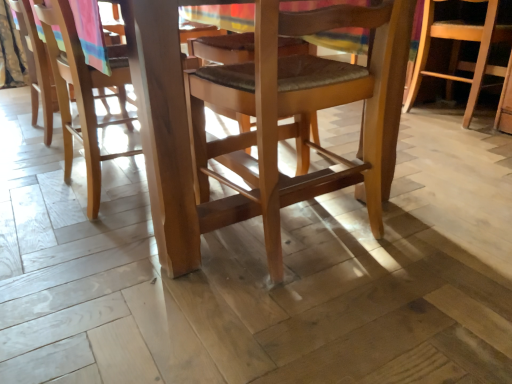
Question: Is light brown wood chair at left, placed as the 1th chair when sorted from left to right, wider than wooden chair at center, which appears as the first chair when viewed from the front?

Choices:
 (A) no
 (B) yes

Answer: (A)

Question: Does light brown wood chair at left, placed as the 1th chair when sorted from left to right, have a smaller size compared to wooden chair at center, the second chair from the right?

Choices:
 (A) yes
 (B) no

Answer: (A)

Question: From a real-world perspective, does light brown wood chair at left, the 2th chair when ordered from front to back, stand above wooden chair at center, the second chair from the right?

Choices:
 (A) no
 (B) yes

Answer: (B)

Question: Can you see light brown wood chair at left, placed as the 1th chair when sorted from left to right, touching wooden chair at center, the second chair from the right?

Choices:
 (A) yes
 (B) no

Answer: (B)

Question: Is light brown wood chair at left, placed as the 1th chair when sorted from left to right, positioned far away from wooden chair at center, the second chair from the right?

Choices:
 (A) yes
 (B) no

Answer: (A)

Question: Is wooden chair at center, positioned as the 3th chair in left-to-right order, bigger or smaller than light brown wood chair at left, the 3th chair positioned from the right?

Choices:
 (A) small
 (B) big

Answer: (B)

Question: In terms of width, does wooden chair at center, positioned as the 3th chair in left-to-right order, look wider or thinner when compared to light brown wood chair at left, placed as the 1th chair when sorted from left to right?

Choices:
 (A) wide
 (B) thin

Answer: (A)

Question: Is wooden chair at center, positioned as the 3th chair in front-to-back order, inside or outside of light brown wood chair at left, placed as the 1th chair when sorted from left to right?

Choices:
 (A) inside
 (B) outside

Answer: (B)

Question: From their relative heights in the image, would you say wooden chair at center, the first chair viewed from the right, is taller or shorter than light brown wood chair at left, the second chair positioned from the back?

Choices:
 (A) short
 (B) tall

Answer: (A)

Question: From a real-world perspective, is light brown wood chair at left, placed as the 1th chair when sorted from left to right, physically located above or below wooden chair at center, positioned as the 3th chair in left-to-right order?

Choices:
 (A) above
 (B) below

Answer: (A)

Question: Considering the positions of light brown wood chair at left, the 2th chair when ordered from front to back, and wooden chair at center, which is counted as the 1th chair, starting from the back, in the image, is light brown wood chair at left, the 2th chair when ordered from front to back, wider or thinner than wooden chair at center, which is counted as the 1th chair, starting from the back,?

Choices:
 (A) thin
 (B) wide

Answer: (A)

Question: Considering the positions of point (34, 94) and point (429, 28), is point (34, 94) closer or farther from the camera than point (429, 28)?

Choices:
 (A) farther
 (B) closer

Answer: (A)

Question: Considering the positions of light brown wood chair at left, the 2th chair when ordered from front to back, and wooden chair at center, which is counted as the 1th chair, starting from the back, in the image, is light brown wood chair at left, the 2th chair when ordered from front to back, taller or shorter than wooden chair at center, which is counted as the 1th chair, starting from the back,?

Choices:
 (A) short
 (B) tall

Answer: (B)

Question: In the image, is light brown wood chair at left, the 3th chair positioned from the right, on the left side or the right side of wooden chair at center, the second chair from the right?

Choices:
 (A) left
 (B) right

Answer: (A)

Question: In the image, is light brown wood chair at left, the 2th chair when ordered from front to back, positioned in front of or behind wooden chair at center, the 3th chair from the back?

Choices:
 (A) behind
 (B) front

Answer: (A)